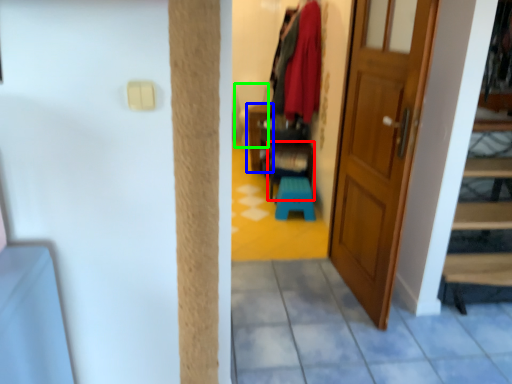
Question: Which is farther away from furniture (highlighted by a red box)? furniture (highlighted by a blue box) or armchair (highlighted by a green box)?

Choices:
 (A) furniture
 (B) armchair

Answer: (B)